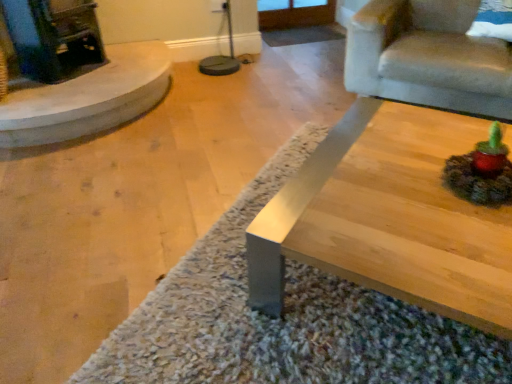
In order to click on free space to the left of shaggy carpet at center in this screenshot , I will do `click(111, 215)`.